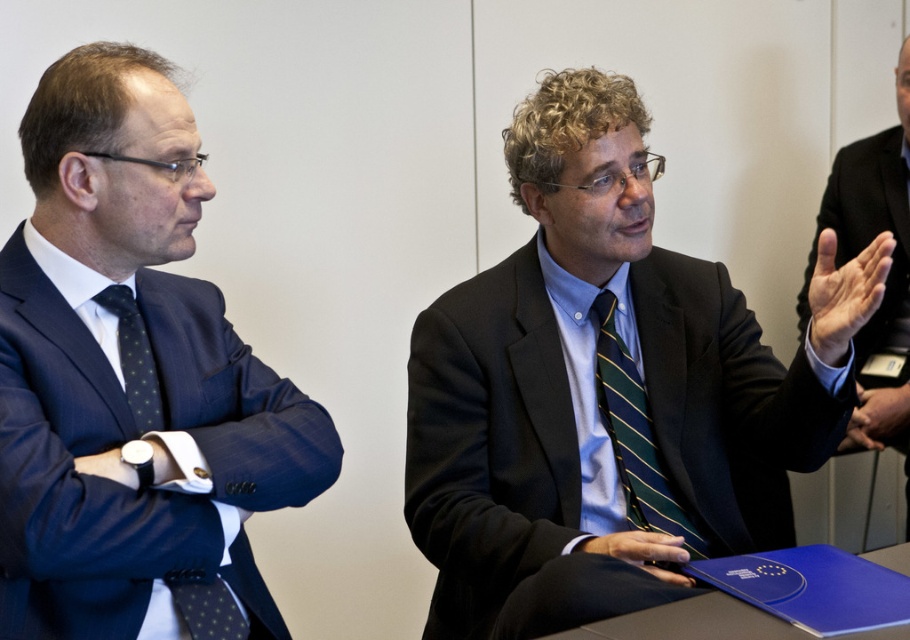
Question: Does matte black suit at center have a larger size compared to dark blue dotted tie at left?

Choices:
 (A) no
 (B) yes

Answer: (B)

Question: Which of these objects is positioned closest to the black suit at center?

Choices:
 (A) green striped tie at center
 (B) matte blue suit at left

Answer: (A)

Question: Is matte black suit at center to the left of dark blue dotted tie at left from the viewer's perspective?

Choices:
 (A) no
 (B) yes

Answer: (A)

Question: Among these points, which one is farthest from the camera?

Choices:
 (A) (243, 618)
 (B) (652, 518)
 (C) (836, 176)
 (D) (147, 396)

Answer: (C)

Question: Which object is closer to the camera taking this photo?

Choices:
 (A) green striped tie at center
 (B) matte blue suit at left
 (C) matte black suit at center

Answer: (B)

Question: Is matte black suit at center wider than black suit at center?

Choices:
 (A) no
 (B) yes

Answer: (B)